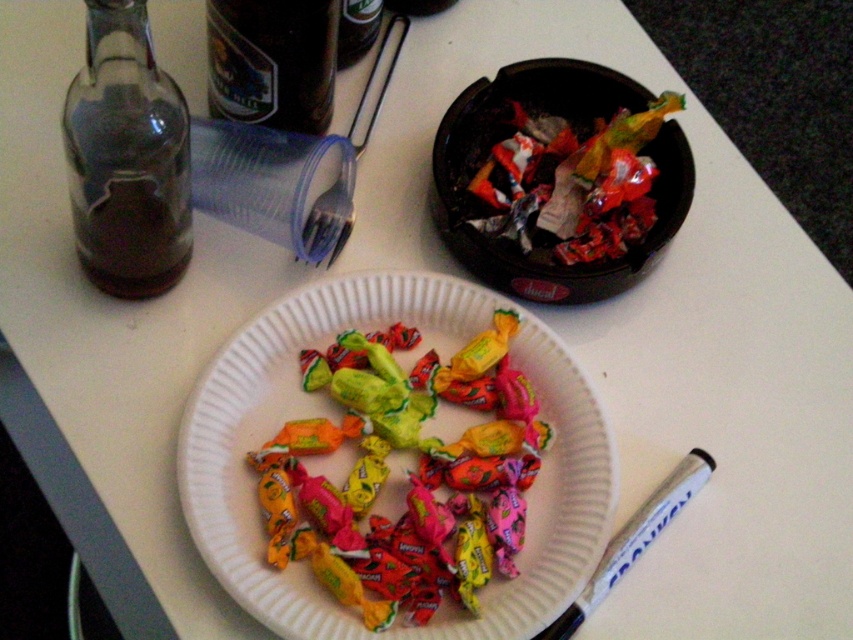
Question: Based on their relative distances, which object is nearer to the transparent glass bottle at left?

Choices:
 (A) glossy paper plate at center
 (B) white glossy marker at lower right
 (C) shiny metallic foil at upper right

Answer: (A)

Question: Can you confirm if shiny metallic foil at upper right is positioned below white glossy marker at lower right?

Choices:
 (A) no
 (B) yes

Answer: (A)

Question: Which point appears closest to the camera in this image?

Choices:
 (A) (190, 520)
 (B) (648, 536)

Answer: (A)

Question: Does transparent glass bottle at left appear on the left side of shiny metallic foil at upper right?

Choices:
 (A) no
 (B) yes

Answer: (B)

Question: Which point is closer to the camera taking this photo?

Choices:
 (A) (207, 68)
 (B) (589, 529)
 (C) (682, 470)

Answer: (B)

Question: Does transparent glass bottle at left have a lesser width compared to shiny metallic foil at upper right?

Choices:
 (A) yes
 (B) no

Answer: (A)